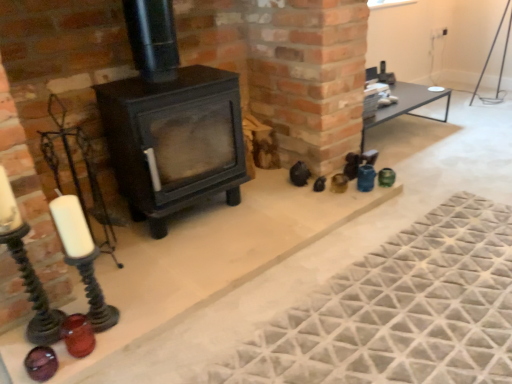
The width and height of the screenshot is (512, 384). What are the coordinates of `free space behind translucent amber glass candle holder at lower left` in the screenshot? It's located at (102, 310).